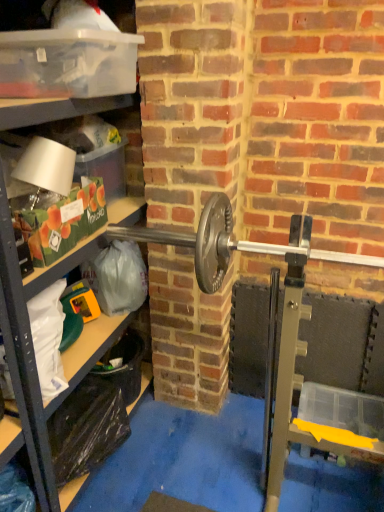
The image size is (384, 512). Describe the element at coordinates (24, 352) in the screenshot. I see `clear plastic shelf at left` at that location.

Identify the location of clear plastic shelf at left. The image size is (384, 512). [24, 352].

Where is `transparent plastic container at upper left`? The image size is (384, 512). transparent plastic container at upper left is located at coordinates (67, 63).

What do you see at coordinates (67, 63) in the screenshot? Image resolution: width=384 pixels, height=512 pixels. I see `transparent plastic container at upper left` at bounding box center [67, 63].

Where is `clear plastic shelf at left`? Image resolution: width=384 pixels, height=512 pixels. clear plastic shelf at left is located at coordinates (24, 352).

Does transparent plastic container at upper left appear on the left side of clear plastic shelf at left?

No.

Between transparent plastic container at upper left and clear plastic shelf at left, which one is positioned in front?

clear plastic shelf at left is in front.

Considering the points (33, 54) and (18, 326), which point is behind, point (33, 54) or point (18, 326)?

The point (33, 54) is farther from the camera.

From the image's perspective, is transparent plastic container at upper left positioned above or below clear plastic shelf at left?

transparent plastic container at upper left is above clear plastic shelf at left.

From a real-world perspective, is transparent plastic container at upper left physically located above or below clear plastic shelf at left?

Clearly, from a real-world perspective, transparent plastic container at upper left is above clear plastic shelf at left.

Is transparent plastic container at upper left thinner than clear plastic shelf at left?

In fact, transparent plastic container at upper left might be wider than clear plastic shelf at left.

Between transparent plastic container at upper left and clear plastic shelf at left, which one has less height?

Standing shorter between the two is transparent plastic container at upper left.

Is transparent plastic container at upper left smaller than clear plastic shelf at left?

Indeed, transparent plastic container at upper left has a smaller size compared to clear plastic shelf at left.

Which is correct: transparent plastic container at upper left is inside clear plastic shelf at left, or outside of it?

transparent plastic container at upper left lies within the bounds of clear plastic shelf at left.

Are transparent plastic container at upper left and clear plastic shelf at left located far from each other?

No, there isn't a large distance between transparent plastic container at upper left and clear plastic shelf at left.

Is transparent plastic container at upper left oriented towards clear plastic shelf at left?

Yes, transparent plastic container at upper left is aimed at clear plastic shelf at left.

Can you tell me how much transparent plastic container at upper left and clear plastic shelf at left differ in facing direction?

6.24 degrees separate the facing orientations of transparent plastic container at upper left and clear plastic shelf at left.

How far apart are transparent plastic container at upper left and clear plastic shelf at left?

The distance of transparent plastic container at upper left from clear plastic shelf at left is 8.52 inches.

Identify the location of box on the right side of clear plastic shelf at left. (67, 63).

Considering the relative positions of clear plastic shelf at left and transparent plastic container at upper left in the image provided, is clear plastic shelf at left to the left or to the right of transparent plastic container at upper left?

clear plastic shelf at left is to the left of transparent plastic container at upper left.

Which object is closer to the camera, clear plastic shelf at left or transparent plastic container at upper left?

clear plastic shelf at left is in front.

Between point (57, 508) and point (48, 72), which one is positioned behind?

Positioned behind is point (57, 508).

From the image's perspective, between clear plastic shelf at left and transparent plastic container at upper left, which one is located above?

transparent plastic container at upper left.

From a real-world perspective, between clear plastic shelf at left and transparent plastic container at upper left, who is vertically higher?

transparent plastic container at upper left is physically above.

In the scene shown: Is clear plastic shelf at left wider than transparent plastic container at upper left?

In fact, clear plastic shelf at left might be narrower than transparent plastic container at upper left.

Considering the sizes of objects clear plastic shelf at left and transparent plastic container at upper left in the image provided, who is taller, clear plastic shelf at left or transparent plastic container at upper left?

clear plastic shelf at left.

Considering the sizes of objects clear plastic shelf at left and transparent plastic container at upper left in the image provided, who is bigger, clear plastic shelf at left or transparent plastic container at upper left?

With larger size is clear plastic shelf at left.

Can we say clear plastic shelf at left lies outside transparent plastic container at upper left?

Yes, clear plastic shelf at left is not within transparent plastic container at upper left.

Are clear plastic shelf at left and transparent plastic container at upper left located far from each other?

No, clear plastic shelf at left is in close proximity to transparent plastic container at upper left.

Is clear plastic shelf at left facing towards transparent plastic container at upper left?

Yes.

Based on the photo, how much distance is there between clear plastic shelf at left and transparent plastic container at upper left?

clear plastic shelf at left and transparent plastic container at upper left are 8.52 inches apart.

Identify the location of box on the right of clear plastic shelf at left. Image resolution: width=384 pixels, height=512 pixels. (67, 63).

Locate an element on the screen. This screenshot has height=512, width=384. box above the clear plastic shelf at left (from the image's perspective) is located at coordinates (67, 63).

At what (x,y) coordinates should I click in order to perform the action: click on shelf in front of the transparent plastic container at upper left. Please return your answer as a coordinate pair (x, y). Image resolution: width=384 pixels, height=512 pixels. Looking at the image, I should click on (24, 352).